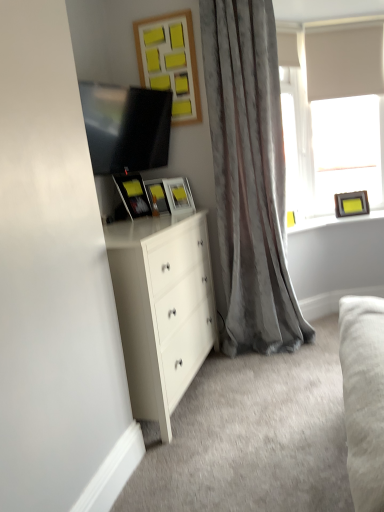
Question: Considering the relative sizes of matte black picture frame at upper right, positioned as the fifth picture frame in left-to-right order, and wooden yellow sticky notes at upper center, which is counted as the third picture frame, starting from the left, in the image provided, is matte black picture frame at upper right, positioned as the fifth picture frame in left-to-right order, smaller than wooden yellow sticky notes at upper center, which is counted as the third picture frame, starting from the left,?

Choices:
 (A) no
 (B) yes

Answer: (B)

Question: From a real-world perspective, is matte black picture frame at upper right, the 1th picture frame from the right, located beneath wooden yellow sticky notes at upper center, acting as the 3th picture frame starting from the right?

Choices:
 (A) no
 (B) yes

Answer: (B)

Question: From the image's perspective, would you say matte black picture frame at upper right, positioned as the fifth picture frame in left-to-right order, is positioned over wooden yellow sticky notes at upper center, acting as the 3th picture frame starting from the right?

Choices:
 (A) no
 (B) yes

Answer: (A)

Question: Can you confirm if matte black picture frame at upper right, the 1th picture frame from the right, is taller than wooden yellow sticky notes at upper center, which is counted as the third picture frame, starting from the left?

Choices:
 (A) yes
 (B) no

Answer: (B)

Question: Considering the relative positions of matte black picture frame at upper right, the 1th picture frame from the right, and wooden yellow sticky notes at upper center, acting as the 3th picture frame starting from the right, in the image provided, is matte black picture frame at upper right, the 1th picture frame from the right, to the left of wooden yellow sticky notes at upper center, acting as the 3th picture frame starting from the right, from the viewer's perspective?

Choices:
 (A) no
 (B) yes

Answer: (A)

Question: Based on their sizes in the image, would you say matte yellow picture frame at upper center, arranged as the 4th picture frame when viewed from the left, is bigger or smaller than white soft fabric couch at lower right?

Choices:
 (A) big
 (B) small

Answer: (B)

Question: Is matte yellow picture frame at upper center, which ranks as the second picture frame in right-to-left order, taller or shorter than white soft fabric couch at lower right?

Choices:
 (A) tall
 (B) short

Answer: (A)

Question: Is point (182, 212) closer or farther from the camera than point (380, 417)?

Choices:
 (A) closer
 (B) farther

Answer: (B)

Question: Looking at their shapes, would you say matte yellow picture frame at upper center, which ranks as the second picture frame in right-to-left order, is wider or thinner than white soft fabric couch at lower right?

Choices:
 (A) thin
 (B) wide

Answer: (A)

Question: Visually, is matte black picture frame at upper right, the 1th picture frame from the right, positioned to the left or to the right of white matte window at upper right?

Choices:
 (A) right
 (B) left

Answer: (A)

Question: Is point (340, 207) closer or farther from the camera than point (365, 132)?

Choices:
 (A) farther
 (B) closer

Answer: (A)

Question: From a real-world perspective, relative to white matte window at upper right, is matte black picture frame at upper right, positioned as the fifth picture frame in left-to-right order, vertically above or below?

Choices:
 (A) above
 (B) below

Answer: (B)

Question: From the image's perspective, is matte black picture frame at upper right, positioned as the fifth picture frame in left-to-right order, above or below white matte window at upper right?

Choices:
 (A) below
 (B) above

Answer: (A)

Question: Looking at their shapes, would you say matte black picture frame at upper right, the 1th picture frame from the right, is wider or thinner than wooden yellow sticky notes at upper center, acting as the 3th picture frame starting from the right?

Choices:
 (A) thin
 (B) wide

Answer: (B)

Question: Does point (360, 212) appear closer or farther from the camera than point (162, 78)?

Choices:
 (A) closer
 (B) farther

Answer: (B)